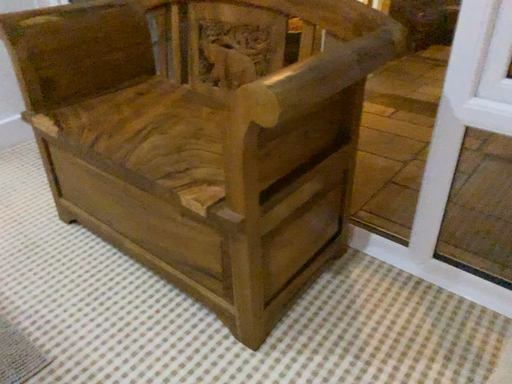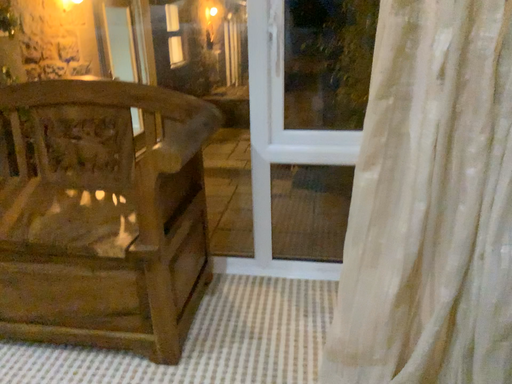
Question: Which way did the camera rotate in the video?

Choices:
 (A) rotated upward
 (B) rotated downward

Answer: (A)